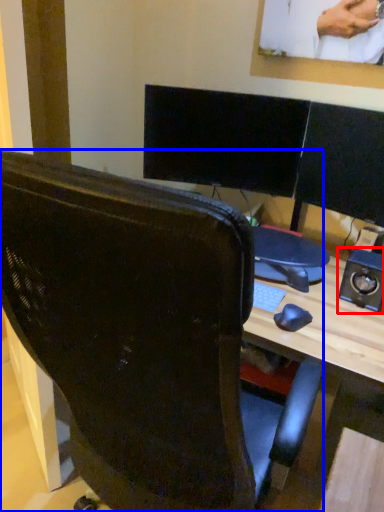
Question: Which object appears closest to the camera in this image, speaker (highlighted by a red box) or chair (highlighted by a blue box)?

Choices:
 (A) speaker
 (B) chair

Answer: (B)